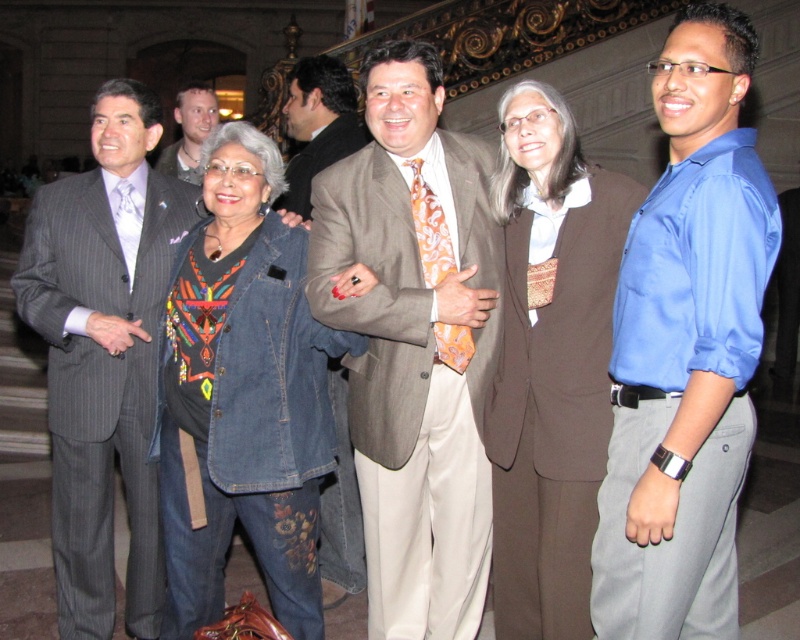
Is gray pinstripe suit at left bigger than brown textured suit at center?

Indeed, gray pinstripe suit at left has a larger size compared to brown textured suit at center.

Is gray pinstripe suit at left above brown textured suit at center?

No.

Which is in front, point (114, 344) or point (302, 148)?

Point (114, 344) is in front.

This screenshot has width=800, height=640. I want to click on gray pinstripe suit at left, so click(x=102, y=378).

Who is more distant from viewer, [288,291] or [24,317]?

The point [24,317] is behind.

How far apart are denim jacket at center and gray pinstripe suit at left?

denim jacket at center is 1.44 meters away from gray pinstripe suit at left.

Between point (328, 397) and point (81, 209), which one is positioned behind?

The point (81, 209) is more distant.

The height and width of the screenshot is (640, 800). Find the location of `denim jacket at center`. denim jacket at center is located at coordinates (244, 394).

Does blue cotton shirt at right have a greater width compared to matte brown suit at center?

No.

Is point (649, 508) positioned before point (437, 221)?

Yes, point (649, 508) is closer to viewer.

Find the location of a particular element. This screenshot has height=640, width=800. blue cotton shirt at right is located at coordinates coord(686,348).